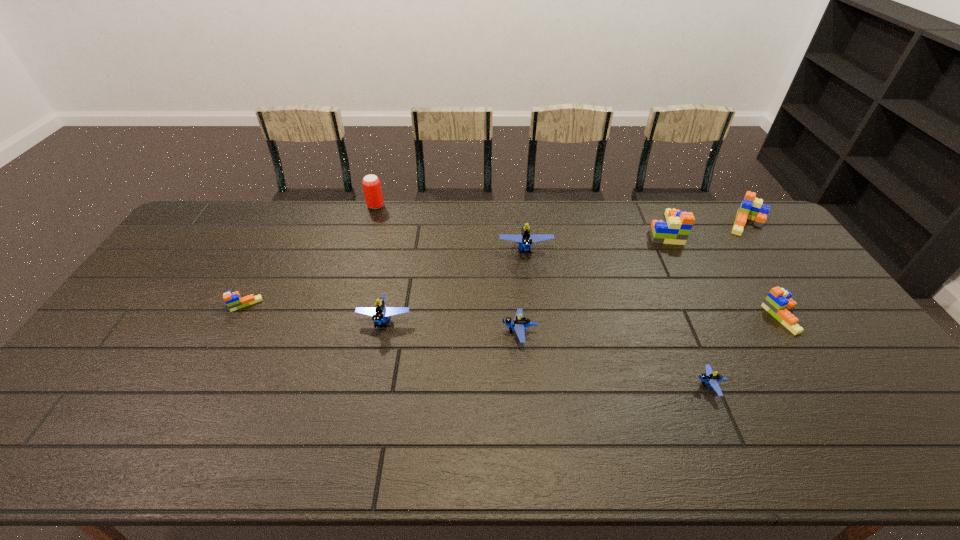
This screenshot has width=960, height=540. I want to click on free spot between the nearest object and the third smallest orange Lego, so (x=728, y=305).

Identify the location of free space between the farthest blue Lego and the third biggest blue Lego. Image resolution: width=960 pixels, height=540 pixels. (523, 291).

Select which object appears as the seventh closest to the red beer can. Please provide its 2D coordinates. Your answer should be formatted as a tuple, i.e. [(x, y)], where the tuple contains the x and y coordinates of a point satisfying the conditions above.

[(751, 208)]

Identify which object is the nearest to the third biggest blue Lego. Please provide its 2D coordinates. Your answer should be formatted as a tuple, i.e. [(x, y)], where the tuple contains the x and y coordinates of a point satisfying the conditions above.

[(525, 239)]

You are a GUI agent. You are given a task and a screenshot of the screen. Output one action in this format:
    pyautogui.click(x=<x>, y=<y>)
    Task: Click on the Lego object that ranks as the closest to the nearest blue Lego
    
    Given the screenshot: What is the action you would take?
    pyautogui.click(x=778, y=303)

The image size is (960, 540). Identify the location of Lego that stands as the fourth closest to the smallest blue Lego. (525, 239).

At what (x,y) coordinates should I click in order to perform the action: click on orange Lego that is the third nearest to the third smallest orange Lego. Please return your answer as a coordinate pair (x, y). The image size is (960, 540). Looking at the image, I should click on (233, 300).

Choose which orange Lego is the fourth nearest neighbor to the farthest object. Please provide its 2D coordinates. Your answer should be formatted as a tuple, i.e. [(x, y)], where the tuple contains the x and y coordinates of a point satisfying the conditions above.

[(778, 303)]

At what (x,y) coordinates should I click in order to perform the action: click on blue Lego that is the third closest to the second smallest blue Lego. Please return your answer as a coordinate pair (x, y). Image resolution: width=960 pixels, height=540 pixels. Looking at the image, I should click on (710, 377).

Locate which blue Lego ranks second in proximity to the seventh Lego from right to left. Please provide its 2D coordinates. Your answer should be formatted as a tuple, i.e. [(x, y)], where the tuple contains the x and y coordinates of a point satisfying the conditions above.

[(525, 239)]